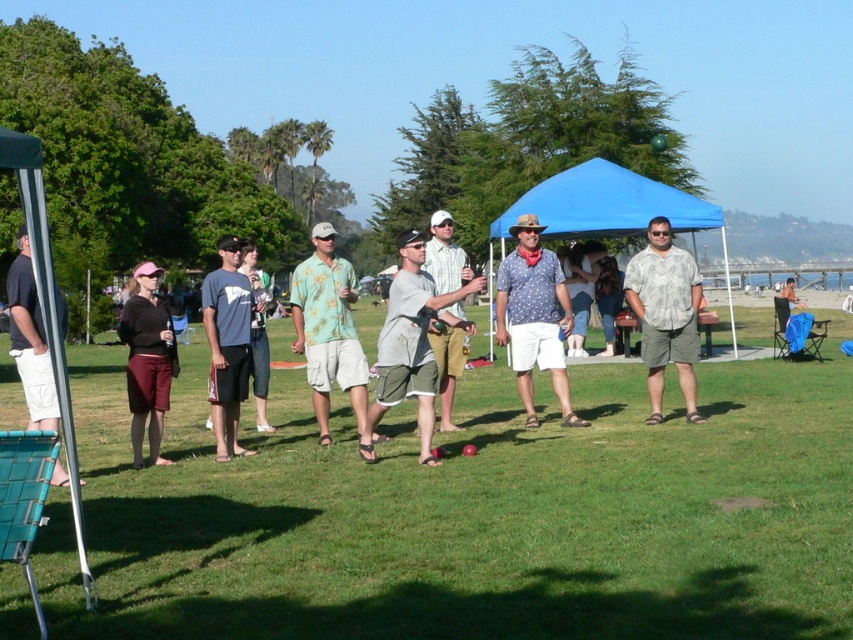
Question: Considering the relative positions of floral print shirt at center and dark gray shorts at left in the image provided, where is floral print shirt at center located with respect to dark gray shorts at left?

Choices:
 (A) above
 (B) below

Answer: (B)

Question: Can you confirm if patterned cotton shirt at center is positioned above printed cotton shirt at center?

Choices:
 (A) yes
 (B) no

Answer: (A)

Question: Is floral print shirt at center smaller than matte gray t-shirt at center?

Choices:
 (A) yes
 (B) no

Answer: (B)

Question: Among these points, which one is nearest to the camera?

Choices:
 (A) (167, 380)
 (B) (84, 595)

Answer: (B)

Question: Which point appears closest to the camera in this image?

Choices:
 (A) (552, 296)
 (B) (22, 273)
 (C) (50, 288)
 (D) (379, 438)

Answer: (C)

Question: Which of the following is the closest to the observer?

Choices:
 (A) (717, 480)
 (B) (160, 317)

Answer: (A)